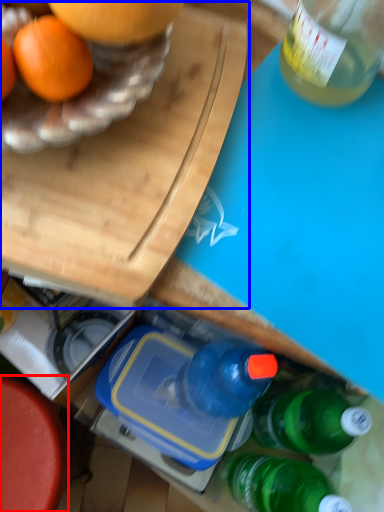
Question: Which of the following is the farthest to the observer, round table (highlighted by a red box) or cutting board (highlighted by a blue box)?

Choices:
 (A) round table
 (B) cutting board

Answer: (A)